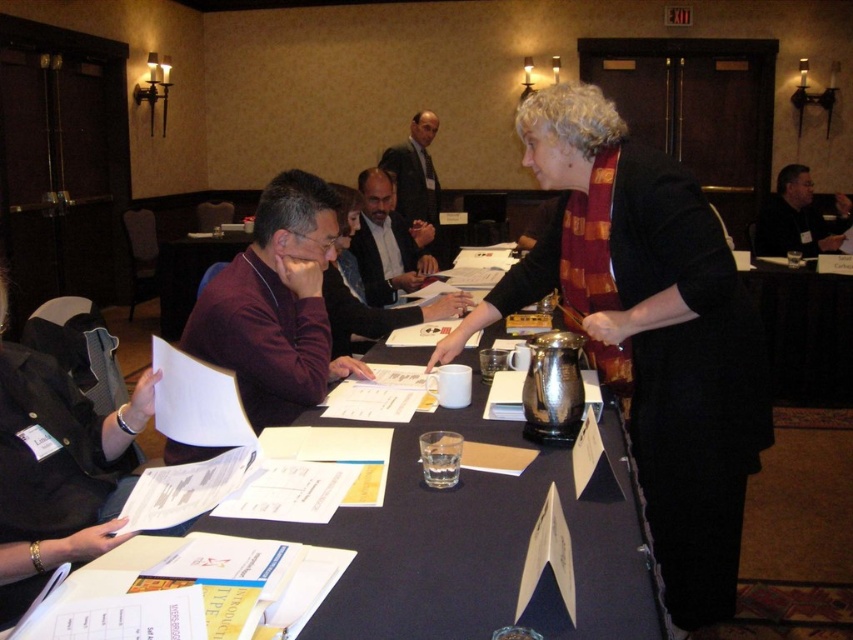
Question: Among these objects, which one is farthest from the camera?

Choices:
 (A) metallic silver pitcher at center
 (B) dark brown leather jacket at center

Answer: (B)

Question: Is dark gray suit at upper right wider than dark suit jacket at center?

Choices:
 (A) yes
 (B) no

Answer: (A)

Question: Can you confirm if maroon scarf at center is thinner than dark gray suit at upper right?

Choices:
 (A) no
 (B) yes

Answer: (B)

Question: Is maroon scarf at center to the left of metallic silver pitcher at center from the viewer's perspective?

Choices:
 (A) yes
 (B) no

Answer: (B)

Question: Which point appears farthest from the camera in this image?

Choices:
 (A) (432, 168)
 (B) (387, 189)

Answer: (A)

Question: Considering the real-world distances, which object is closest to the maroon scarf at center?

Choices:
 (A) dark gray suit at upper right
 (B) metallic silver pitcher at center

Answer: (B)